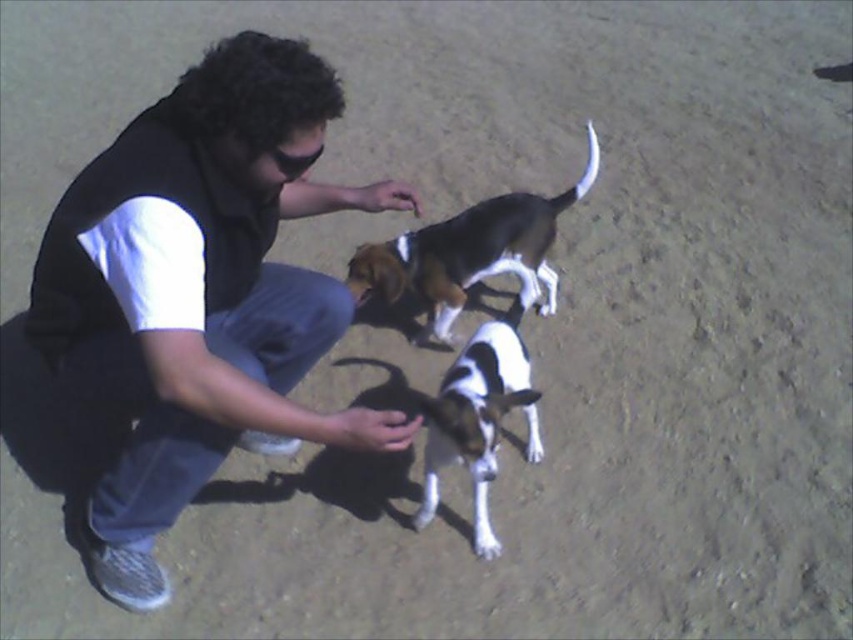
Based on the photo, you are standing at the point with coordinates (200, 291) in the image. What object are you directly at?

You are directly at the black matte shirt at center.

You are a photographer trying to capture a photo of the white and brown fur dog at center and the white fur paw at lower center. Can you fit both subjects in the frame if your camera has a limited vertical field of view?

The white and brown fur dog at center is above the white fur paw at lower center, so they are vertically aligned. Since they are stacked vertically, the limited vertical field of view might make it challenging to capture both in the same frame.

You are a dog trainer who needs to fit both dogs into a transport crate that can only accommodate a total width of 1.2 meters. Given the black and white fur dog at center and the white and brown fur dog at center, can you determine if their combined width will exceed the crate limit?

The black and white fur dog at center is wider than the white and brown fur dog at center. However, without knowing the exact widths of each dog, it is impossible to determine if their combined width exceeds 1.2 meters. Additional measurements are needed.